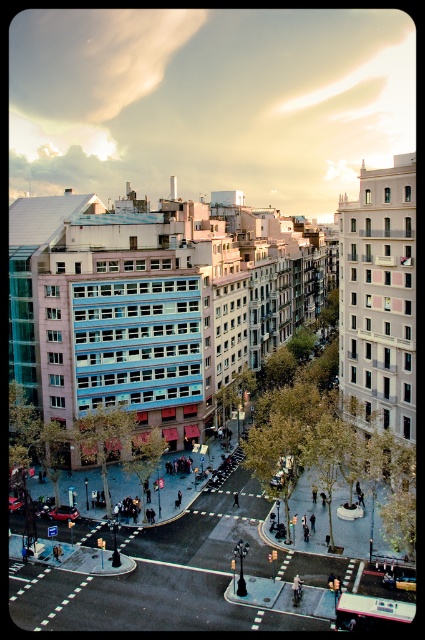
You are a pedestrian standing on the plaza and want to cross the street to reach the park on the other side. There are two cars in front of you, a metallic silver car at center and a metallic red car at center. Which car is closer to you that you need to be cautious of?

The metallic silver car at center is closer to the viewer than the metallic red car at center, so you need to be cautious of the metallic silver car at center first.

You are a delivery person trying to park your delivery van, which is 2 meters wide, in the parking lot. You see the metallic silver car at center and the metallic red car at center. Can you fit your van between them if they are parked side by side?

The metallic silver car at center might be wider than metallic red car at center. If the combined width of both cars exceeds the available space, the van may not fit. However, without exact measurements, it is uncertain.

You are a pedestrian standing on the plaza and want to cross the street to reach the buildings. Which car should you avoid first when crossing the street, the metallic silver car at center or the metallic red car at center?

You should avoid the metallic red car at center first because the metallic silver car at center is to the right of it, meaning the metallic red car at center is closer to your starting position on the plaza.